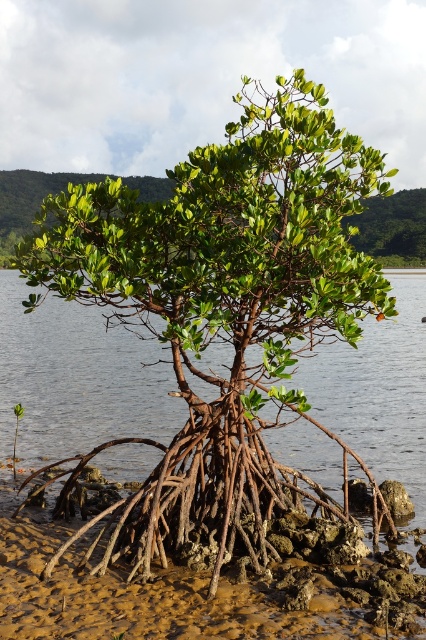
You are a botanist examining the mangrove tree and its roots. Which object has a larger size between the green matte tree at center and the brown mud roots at center?

The green matte tree at center is bigger than the brown mud roots at center according to the description.

You are a bird flying over a mangrove forest. You see a point at coordinates (224,310). What is located at that point?

The point at coordinates (224,310) is occupied by the green matte tree at center.